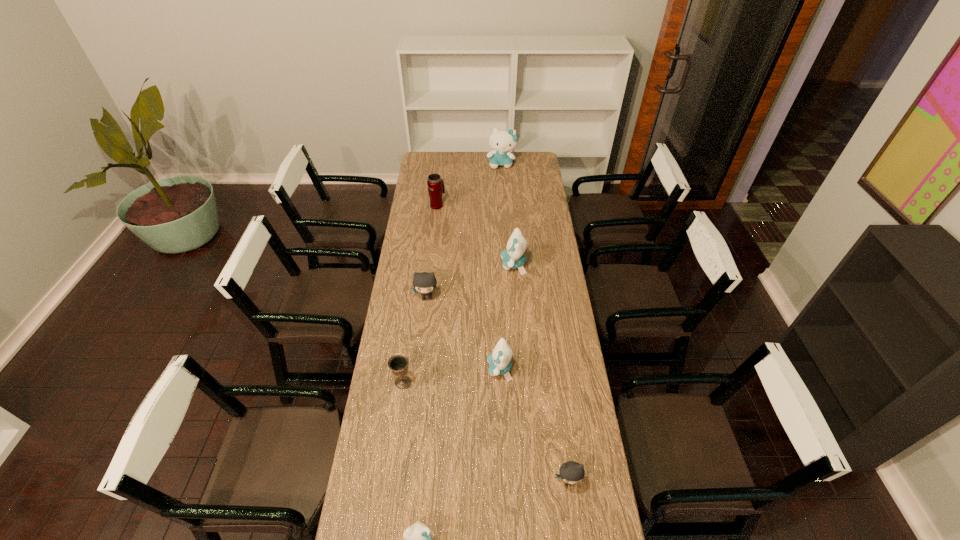
I want to click on bronze chalice, so click(398, 363).

Identify the location of the rightmost kitten. (571, 472).

Locate an element on the screen. The height and width of the screenshot is (540, 960). the second nearest kitten is located at coordinates (571, 472).

The image size is (960, 540). In order to click on blank space located 0.300m on the face of the tallest object in this screenshot , I will do `click(504, 201)`.

You are a GUI agent. You are given a task and a screenshot of the screen. Output one action in this format:
    pyautogui.click(x=<x>, y=<y>)
    Task: Click on the vacant space situated 0.390m on the face of the third nearest blue kitten
    This screenshot has height=540, width=960.
    Given the screenshot: What is the action you would take?
    pyautogui.click(x=419, y=265)

Where is `free spot located 0.270m on the face of the third nearest blue kitten`? free spot located 0.270m on the face of the third nearest blue kitten is located at coordinates (444, 265).

Identify the location of vacant point located 0.400m on the face of the third nearest blue kitten. This screenshot has width=960, height=540. (417, 265).

The height and width of the screenshot is (540, 960). Identify the location of vacant area situated 0.360m on the side with the handle of the second farthest object. (442, 165).

The height and width of the screenshot is (540, 960). I want to click on vacant space located on the side with the handle of the second farthest object, so click(441, 177).

I want to click on free spot located on the side with the handle of the second farthest object, so click(x=440, y=184).